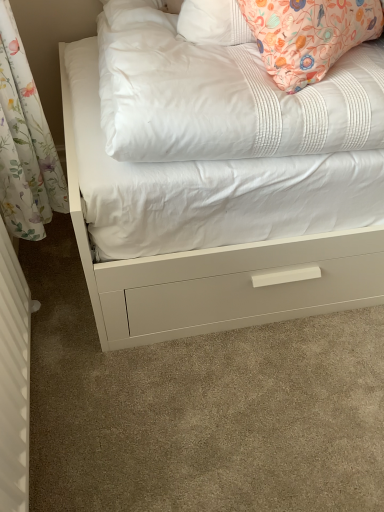
What are the coordinates of `white textured radiator at left` in the screenshot? It's located at (14, 379).

Measure the distance between point (x=7, y=286) and camera.

A distance of 39.09 inches exists between point (x=7, y=286) and camera.

What do you see at coordinates (14, 379) in the screenshot?
I see `white textured radiator at left` at bounding box center [14, 379].

Measure the distance between white quilted mattress at upper center and camera.

white quilted mattress at upper center is 84.06 centimeters away from camera.

The image size is (384, 512). Describe the element at coordinates (226, 98) in the screenshot. I see `white quilted mattress at upper center` at that location.

Where is `white quilted mattress at upper center`? Image resolution: width=384 pixels, height=512 pixels. white quilted mattress at upper center is located at coordinates (226, 98).

Locate an element on the screen. white textured radiator at left is located at coordinates (14, 379).

Is white quilted mattress at upper center to the right of white textured radiator at left from the viewer's perspective?

Indeed, white quilted mattress at upper center is positioned on the right side of white textured radiator at left.

Which object is closer to the camera, white quilted mattress at upper center or white textured radiator at left?

white textured radiator at left is more forward.

Between point (338, 82) and point (9, 453), which one is positioned behind?

Positioned behind is point (338, 82).

From the image's perspective, between white quilted mattress at upper center and white textured radiator at left, who is located below?

white textured radiator at left is shown below in the image.

From a real-world perspective, is white quilted mattress at upper center on white textured radiator at left?

Indeed, from a real-world perspective, white quilted mattress at upper center stands above white textured radiator at left.

Considering the relative sizes of white quilted mattress at upper center and white textured radiator at left in the image provided, is white quilted mattress at upper center thinner than white textured radiator at left?

No, white quilted mattress at upper center is not thinner than white textured radiator at left.

Does white quilted mattress at upper center have a greater height compared to white textured radiator at left?

No.

Is white quilted mattress at upper center bigger than white textured radiator at left?

Yes.

In the scene shown: Is white textured radiator at left located within white quilted mattress at upper center?

No, white textured radiator at left is not a part of white quilted mattress at upper center.

Is there a large distance between white quilted mattress at upper center and white textured radiator at left?

That's not correct — white quilted mattress at upper center is a little close to white textured radiator at left.

Could you tell me if white quilted mattress at upper center is turned towards white textured radiator at left?

No, white quilted mattress at upper center is not oriented towards white textured radiator at left.

The image size is (384, 512). What are the coordinates of `radiator on the left of white quilted mattress at upper center` in the screenshot? It's located at 14,379.

Consider the image. In the image, is white textured radiator at left on the left side or the right side of white quilted mattress at upper center?

white textured radiator at left is to the left of white quilted mattress at upper center.

Does white textured radiator at left lie behind white quilted mattress at upper center?

No, white textured radiator at left is closer to the viewer.

Which is in front, point (9, 419) or point (368, 123)?

The point (9, 419) is closer.

From the image's perspective, would you say white textured radiator at left is shown under white quilted mattress at upper center?

Indeed, from the image's perspective, white textured radiator at left is shown beneath white quilted mattress at upper center.

From a real-world perspective, is white textured radiator at left on top of white quilted mattress at upper center?

No, from a real-world perspective, white textured radiator at left is not on top of white quilted mattress at upper center.

Considering the sizes of objects white textured radiator at left and white quilted mattress at upper center in the image provided, who is thinner, white textured radiator at left or white quilted mattress at upper center?

white textured radiator at left is thinner.

From their relative heights in the image, would you say white textured radiator at left is taller or shorter than white quilted mattress at upper center?

In the image, white textured radiator at left appears to be taller than white quilted mattress at upper center.

Considering the sizes of objects white textured radiator at left and white quilted mattress at upper center in the image provided, who is smaller, white textured radiator at left or white quilted mattress at upper center?

white textured radiator at left is smaller.

Would you say white textured radiator at left is inside or outside white quilted mattress at upper center?

white textured radiator at left is located beyond the bounds of white quilted mattress at upper center.

Is the surface of white textured radiator at left in direct contact with white quilted mattress at upper center?

There is a gap between white textured radiator at left and white quilted mattress at upper center.

Is white textured radiator at left facing away from white quilted mattress at upper center?

No, white textured radiator at left is not facing the opposite direction of white quilted mattress at upper center.

How many degrees apart are the facing directions of white textured radiator at left and white quilted mattress at upper center?

63.4 degrees separate the facing orientations of white textured radiator at left and white quilted mattress at upper center.

Where is `mattress that is above the white textured radiator at left (from a real-world perspective)`? This screenshot has height=512, width=384. mattress that is above the white textured radiator at left (from a real-world perspective) is located at coordinates (226, 98).

The height and width of the screenshot is (512, 384). In the image, there is a white textured radiator at left. Find the location of `mattress above it (from the image's perspective)`. mattress above it (from the image's perspective) is located at coordinates (226, 98).

The image size is (384, 512). What are the coordinates of `radiator in front of the white quilted mattress at upper center` in the screenshot? It's located at (14, 379).